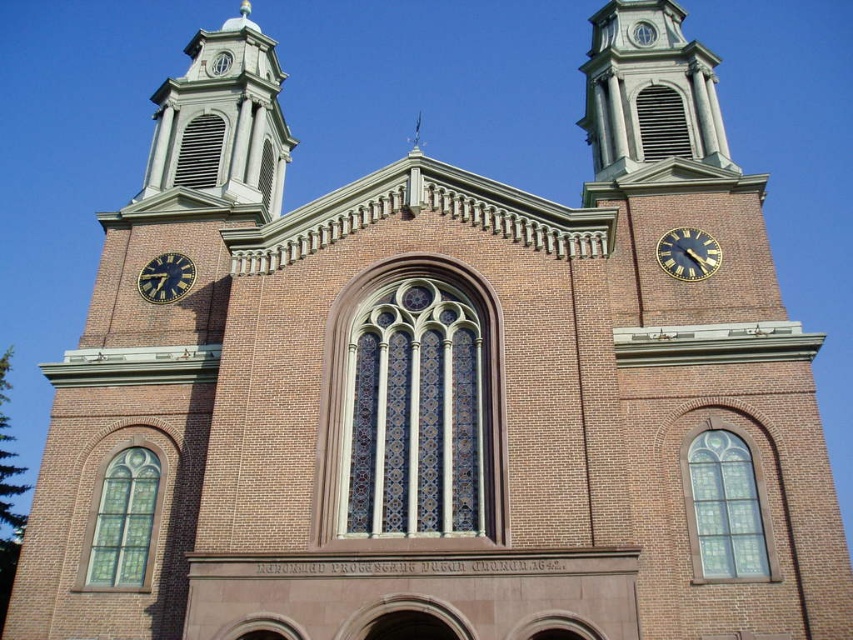
You are standing in front of the church and notice two points on the facade. One is at point (676, 227) and the other is at point (149, 260). Which point is closer to your eyes?

Point (676, 227) is closer to the camera than point (149, 260).